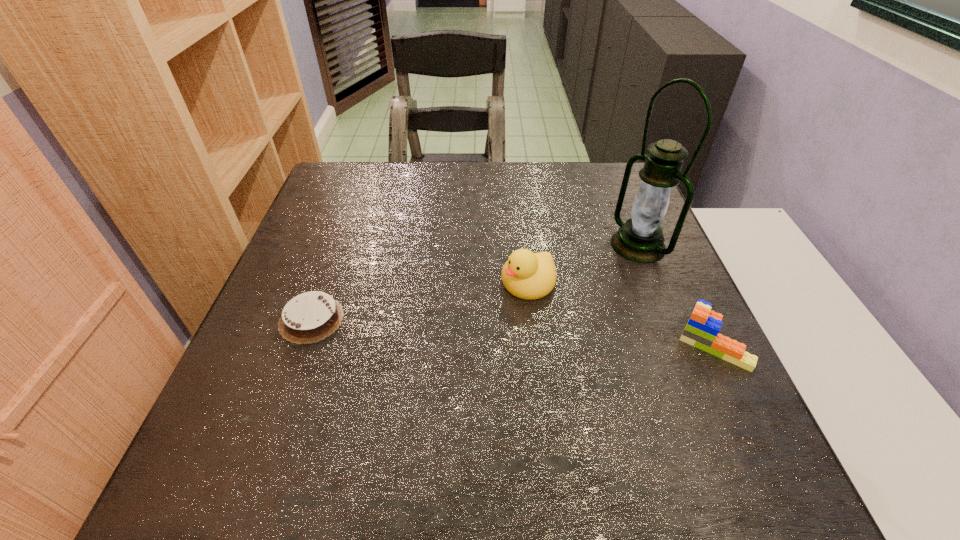
Image resolution: width=960 pixels, height=540 pixels. What are the coordinates of `vacant region located on the side where the lantern emits light` in the screenshot? It's located at [x=516, y=313].

Where is `free space located 0.260m on the face of the second tallest object`? free space located 0.260m on the face of the second tallest object is located at coordinates (406, 359).

What are the coordinates of `vacant space positioned 0.240m on the face of the second tallest object` in the screenshot? It's located at (416, 353).

Locate an element on the screen. vacant position located 0.350m on the face of the second tallest object is located at coordinates (364, 385).

Locate an element on the screen. This screenshot has width=960, height=540. object that is at the left edge is located at coordinates (309, 317).

Locate an element on the screen. Lego situated at the right edge is located at coordinates (703, 326).

I want to click on lantern that is at the right edge, so click(x=640, y=239).

Find the location of a particular element. The height and width of the screenshot is (540, 960). vacant region at the far edge of the desktop is located at coordinates (535, 172).

This screenshot has width=960, height=540. In the image, there is a desktop. In order to click on vacant space at the near edge in this screenshot , I will do `click(329, 392)`.

The height and width of the screenshot is (540, 960). I want to click on vacant space at the left edge, so click(x=317, y=237).